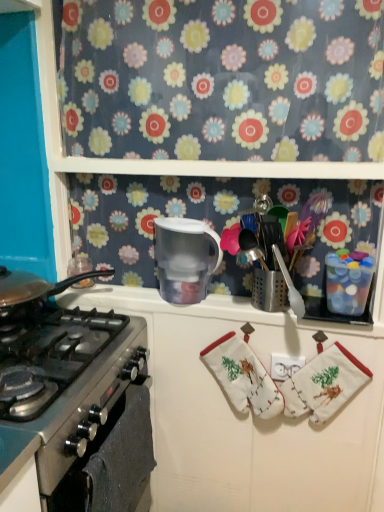
Describe the element at coordinates (285, 365) in the screenshot. I see `white plastic outlet at center` at that location.

What do you see at coordinates (243, 376) in the screenshot? This screenshot has height=512, width=384. I see `white fabric hand towel at center` at bounding box center [243, 376].

Locate an element on the screen. Image resolution: width=384 pixels, height=512 pixels. white cotton oven mitts at lower right is located at coordinates (324, 384).

Locate an element on the screen. transparent plastic pitcher at center is located at coordinates (185, 258).

The width and height of the screenshot is (384, 512). What are the coordinates of `stainless steel oven at lower left` in the screenshot? It's located at (112, 461).

The image size is (384, 512). I want to click on white plastic outlet at center, so click(285, 365).

Is white fabric hand towel at center at the left side of white plastic outlet at center?

Yes, white fabric hand towel at center is to the left of white plastic outlet at center.

Is white fabric hand towel at center not within white plastic outlet at center?

Indeed, white fabric hand towel at center is completely outside white plastic outlet at center.

Does point (260, 410) appear closer or farther from the camera than point (298, 362)?

Clearly, point (260, 410) is more distant from the camera than point (298, 362).

From the image's perspective, does white fabric hand towel at center appear lower than white plastic outlet at center?

Yes, from the image's perspective, white fabric hand towel at center is below white plastic outlet at center.

Considering the relative positions of white cotton oven mitts at lower right and transparent plastic pitcher at center in the image provided, is white cotton oven mitts at lower right to the right of transparent plastic pitcher at center from the viewer's perspective?

Indeed, white cotton oven mitts at lower right is positioned on the right side of transparent plastic pitcher at center.

Is the depth of white cotton oven mitts at lower right less than that of transparent plastic pitcher at center?

Yes, white cotton oven mitts at lower right is in front of transparent plastic pitcher at center.

Looking at the image, does white cotton oven mitts at lower right seem bigger or smaller compared to transparent plastic pitcher at center?

white cotton oven mitts at lower right is bigger than transparent plastic pitcher at center.

Is white cotton oven mitts at lower right taller or shorter than transparent plastic pitcher at center?

In the image, white cotton oven mitts at lower right appears to be taller than transparent plastic pitcher at center.

From the image's perspective, between stainless steel oven at lower left and transparent plastic pitcher at center, which one is located above?

transparent plastic pitcher at center.

Is stainless steel oven at lower left shorter than transparent plastic pitcher at center?

No.

Consider the image. Which is correct: stainless steel oven at lower left is inside transparent plastic pitcher at center, or outside of it?

stainless steel oven at lower left lies outside transparent plastic pitcher at center.

From a real-world perspective, is stainless steel oven at lower left beneath transparent plastic pitcher at center?

Yes, from a real-world perspective, stainless steel oven at lower left is under transparent plastic pitcher at center.

Is stainless steel gas stove at left at the back of white plastic outlet at center?

That's not correct — white plastic outlet at center is not looking away from stainless steel gas stove at left.

From a real-world perspective, relative to stainless steel gas stove at left, is white plastic outlet at center vertically above or below?

white plastic outlet at center is below stainless steel gas stove at left.

Which is in front, white plastic outlet at center or stainless steel gas stove at left?

stainless steel gas stove at left is more forward.

Between white plastic outlet at center and stainless steel gas stove at left, which one has larger size?

stainless steel gas stove at left is bigger.

Which of these two, stainless steel oven at lower left or white plastic outlet at center, is bigger?

stainless steel oven at lower left.

Would you say stainless steel oven at lower left is a long distance from white plastic outlet at center?

No, stainless steel oven at lower left is not far away from white plastic outlet at center.

Is point (91, 498) closer to camera compared to point (278, 360)?

Yes, point (91, 498) is in front of point (278, 360).

You are a GUI agent. You are given a task and a screenshot of the screen. Output one action in this format:
    pyautogui.click(x=<x>, y=<y>)
    Task: Click on the oven in front of the white plastic outlet at center
    
    Given the screenshot: What is the action you would take?
    pyautogui.click(x=112, y=461)

Measure the distance between stainless steel gas stove at left and stainless steel oven at lower left.

A distance of 3.45 inches exists between stainless steel gas stove at left and stainless steel oven at lower left.

Is point (80, 490) positioned behind point (132, 386)?

No, it is not.

From a real-world perspective, who is located higher, stainless steel gas stove at left or stainless steel oven at lower left?

In real-world perspective, stainless steel gas stove at left is above.

Considering the sizes of stainless steel gas stove at left and stainless steel oven at lower left in the image, is stainless steel gas stove at left taller or shorter than stainless steel oven at lower left?

stainless steel gas stove at left is shorter than stainless steel oven at lower left.

Which is more to the right, white fabric hand towel at center or stainless steel gas stove at left?

Positioned to the right is white fabric hand towel at center.

From the picture: Which object is wider, white fabric hand towel at center or stainless steel gas stove at left?

stainless steel gas stove at left.

Is white fabric hand towel at center aimed at stainless steel gas stove at left?

No, white fabric hand towel at center is not turned towards stainless steel gas stove at left.

The width and height of the screenshot is (384, 512). Find the location of `gas stove located above the white fabric hand towel at center (from a real-world perspective)`. gas stove located above the white fabric hand towel at center (from a real-world perspective) is located at coordinates (78, 409).

Where is `hand towel in front of the white plastic outlet at center`? The width and height of the screenshot is (384, 512). hand towel in front of the white plastic outlet at center is located at coordinates (243, 376).

Where is `material that is below the transparent plastic pitcher at center (from the image's perspective)`? The height and width of the screenshot is (512, 384). material that is below the transparent plastic pitcher at center (from the image's perspective) is located at coordinates (324, 384).

Looking at the image, which one is located further to white plastic outlet at center, stainless steel oven at lower left or white cotton oven mitts at lower right?

stainless steel oven at lower left is further to white plastic outlet at center.

Considering their positions, is white fabric hand towel at center positioned closer to transparent plastic pitcher at center than white cotton oven mitts at lower right?

The object closer to transparent plastic pitcher at center is white fabric hand towel at center.

From the image, which object appears to be nearer to white plastic outlet at center, white cotton oven mitts at lower right or stainless steel gas stove at left?

Among the two, white cotton oven mitts at lower right is located nearer to white plastic outlet at center.

Based on their spatial positions, is stainless steel oven at lower left or stainless steel gas stove at left further from white plastic outlet at center?

stainless steel gas stove at left.

Looking at the image, which one is located closer to white fabric hand towel at center, stainless steel oven at lower left or stainless steel gas stove at left?

Based on the image, stainless steel oven at lower left appears to be nearer to white fabric hand towel at center.

Estimate the real-world distances between objects in this image. Which object is closer to white cotton oven mitts at lower right, floral fabric at upper center or transparent plastic pitcher at center?

transparent plastic pitcher at center is closer to white cotton oven mitts at lower right.

Which object lies further to the anchor point white plastic outlet at center, stainless steel oven at lower left or white fabric hand towel at center?

The object further to white plastic outlet at center is stainless steel oven at lower left.

Considering their positions, is white fabric hand towel at center positioned further to white plastic outlet at center than white cotton oven mitts at lower right?

The object further to white plastic outlet at center is white fabric hand towel at center.

This screenshot has height=512, width=384. Find the location of `tile located between stainless steel gas stove at left and white cotton oven mitts at lower right in the left-right direction`. tile located between stainless steel gas stove at left and white cotton oven mitts at lower right in the left-right direction is located at coordinates (285, 365).

Where is `tile between floral fabric at upper center and white cotton oven mitts at lower right in the up-down direction`? tile between floral fabric at upper center and white cotton oven mitts at lower right in the up-down direction is located at coordinates (285, 365).

Where is `hand towel between stainless steel oven at lower left and white plastic outlet at center in the horizontal direction`? This screenshot has width=384, height=512. hand towel between stainless steel oven at lower left and white plastic outlet at center in the horizontal direction is located at coordinates [243, 376].

What are the coordinates of `gas stove between floral fabric at upper center and stainless steel oven at lower left in the vertical direction` in the screenshot? It's located at (78, 409).